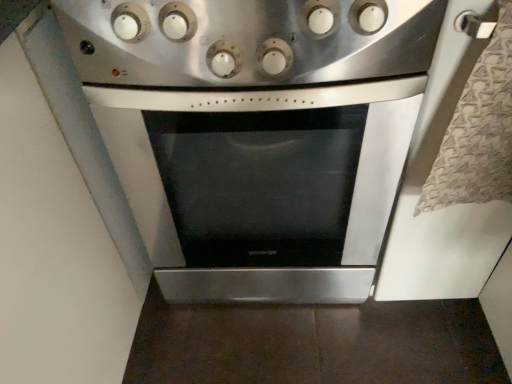
Image resolution: width=512 pixels, height=384 pixels. What do you see at coordinates (257, 134) in the screenshot?
I see `stainless steel oven at center` at bounding box center [257, 134].

You are a GUI agent. You are given a task and a screenshot of the screen. Output one action in this format:
    pyautogui.click(x=<x>, y=<y>)
    Task: Click on the stainless steel oven at center
    This screenshot has width=512, height=384.
    Given the screenshot: What is the action you would take?
    pyautogui.click(x=257, y=134)

Based on the photo, what is the approximate width of stainless steel oven at center?

stainless steel oven at center is 26.23 inches in width.

Describe the element at coordinates (248, 43) in the screenshot. This screenshot has width=512, height=384. I see `satin silver knobs at upper center` at that location.

Find the location of a particular element. The width and height of the screenshot is (512, 384). satin silver knobs at upper center is located at coordinates (248, 43).

Where is `stainless steel oven at center`? stainless steel oven at center is located at coordinates (257, 134).

Considering the relative positions of stainless steel oven at center and satin silver knobs at upper center in the image provided, is stainless steel oven at center to the left of satin silver knobs at upper center from the viewer's perspective?

Incorrect, stainless steel oven at center is not on the left side of satin silver knobs at upper center.

In the image, is stainless steel oven at center positioned in front of or behind satin silver knobs at upper center?

In the image, stainless steel oven at center appears behind satin silver knobs at upper center.

Is point (274, 84) positioned before point (267, 40)?

No, (274, 84) is behind (267, 40).

From the image's perspective, is stainless steel oven at center located above or below satin silver knobs at upper center?

Based on their image positions, stainless steel oven at center is located beneath satin silver knobs at upper center.

From a real-world perspective, relative to satin silver knobs at upper center, is stainless steel oven at center vertically above or below?

stainless steel oven at center is below satin silver knobs at upper center.

Does stainless steel oven at center have a greater width compared to satin silver knobs at upper center?

Yes, stainless steel oven at center is wider than satin silver knobs at upper center.

From the picture: Which of these two, stainless steel oven at center or satin silver knobs at upper center, stands taller?

stainless steel oven at center.

Considering the sizes of objects stainless steel oven at center and satin silver knobs at upper center in the image provided, who is smaller, stainless steel oven at center or satin silver knobs at upper center?

Smaller between the two is satin silver knobs at upper center.

Is stainless steel oven at center inside the boundaries of satin silver knobs at upper center, or outside?

stainless steel oven at center lies outside satin silver knobs at upper center.

Is there a large distance between stainless steel oven at center and satin silver knobs at upper center?

No, stainless steel oven at center is not far from satin silver knobs at upper center.

Is stainless steel oven at center facing away from satin silver knobs at upper center?

That's not correct — stainless steel oven at center is not looking away from satin silver knobs at upper center.

How different are the orientations of stainless steel oven at center and satin silver knobs at upper center in degrees?

stainless steel oven at center and satin silver knobs at upper center are facing 0.000131 degrees away from each other.

Identify the location of kitchen appliance lying below the satin silver knobs at upper center (from the image's perspective). (257, 134).

Which is more to the right, satin silver knobs at upper center or stainless steel oven at center?

Positioned to the right is stainless steel oven at center.

In the image, is satin silver knobs at upper center positioned in front of or behind stainless steel oven at center?

satin silver knobs at upper center is in front of stainless steel oven at center.

Considering the positions of point (356, 61) and point (357, 279), is point (356, 61) closer or farther from the camera than point (357, 279)?

Point (356, 61) appears to be closer to the viewer than point (357, 279).

From the image's perspective, is satin silver knobs at upper center beneath stainless steel oven at center?

Actually, satin silver knobs at upper center appears above stainless steel oven at center in the image.

From a real-world perspective, is satin silver knobs at upper center physically above stainless steel oven at center?

Yes.

Between satin silver knobs at upper center and stainless steel oven at center, which one has smaller width?

Thinner between the two is satin silver knobs at upper center.

Can you confirm if satin silver knobs at upper center is taller than stainless steel oven at center?

No.

In the scene shown: Who is bigger, satin silver knobs at upper center or stainless steel oven at center?

Bigger between the two is stainless steel oven at center.

Is stainless steel oven at center surrounded by satin silver knobs at upper center?

No, stainless steel oven at center is located outside of satin silver knobs at upper center.

Are satin silver knobs at upper center and stainless steel oven at center beside each other?

No.

In the scene shown: Is satin silver knobs at upper center facing away from stainless steel oven at center?

No, satin silver knobs at upper center is not facing away from stainless steel oven at center.

Measure the distance from satin silver knobs at upper center to stainless steel oven at center.

satin silver knobs at upper center and stainless steel oven at center are 5.19 inches apart from each other.

Identify the location of kitchen appliance on the right side of satin silver knobs at upper center. (257, 134).

This screenshot has height=384, width=512. I want to click on kitchen appliance below the satin silver knobs at upper center (from a real-world perspective), so click(257, 134).

Where is `kitchen appliance that is below the satin silver knobs at upper center (from the image's perspective)`? This screenshot has height=384, width=512. kitchen appliance that is below the satin silver knobs at upper center (from the image's perspective) is located at coordinates [x=257, y=134].